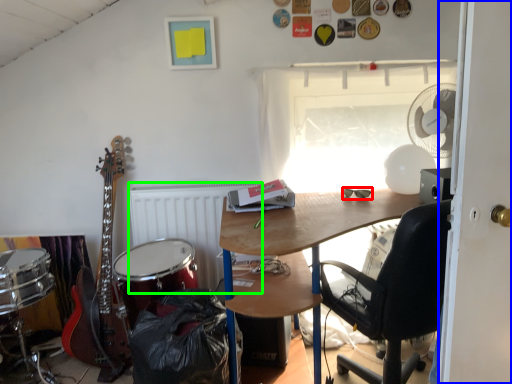
Question: Which is nearer to the glasses (highlighted by a red box)? door (highlighted by a blue box) or radiator (highlighted by a green box).

Choices:
 (A) door
 (B) radiator

Answer: (A)